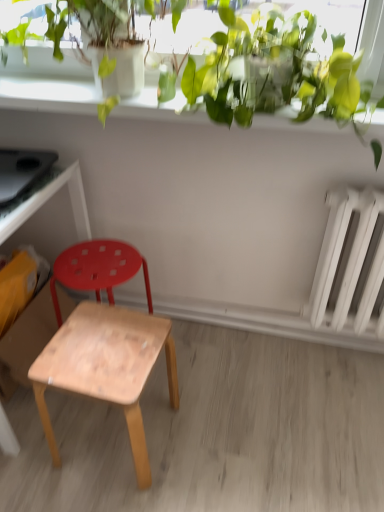
Image resolution: width=384 pixels, height=512 pixels. Identify the location of free point to the right of natural wood stool at center, which is the first stool in front-to-back order. (206, 436).